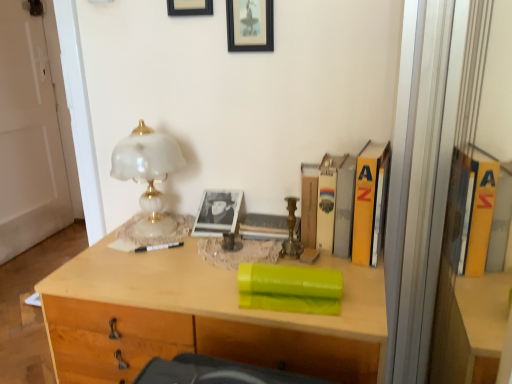
Identify the location of vacant space to the right of green matte book at center, which appears as the 1th book when ordered from the bottom. This screenshot has height=384, width=512. (360, 298).